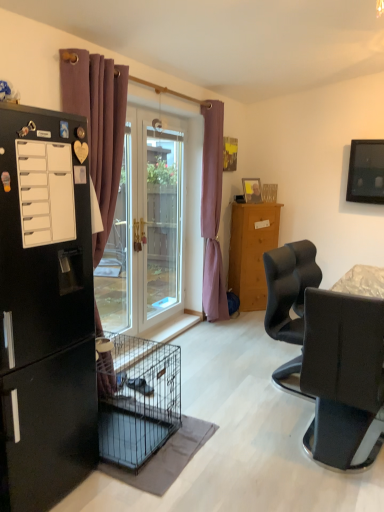
This screenshot has width=384, height=512. In order to click on purple fabric curtain at center, which appears as the second curtain when viewed from the left in this screenshot , I will do `click(212, 211)`.

What do you see at coordinates (44, 312) in the screenshot? I see `black matte refrigerator at left` at bounding box center [44, 312].

What do you see at coordinates (342, 372) in the screenshot? This screenshot has height=512, width=384. I see `matte black chair at right` at bounding box center [342, 372].

The width and height of the screenshot is (384, 512). Describe the element at coordinates (98, 124) in the screenshot. I see `purple fabric curtain at left, the 1th curtain positioned from the left` at that location.

At what (x,y) coordinates should I click in order to perform the action: click on matte black refrigerator at center. Please return your answer as a coordinate pair (x, y). Image resolution: width=384 pixels, height=512 pixels. Looking at the image, I should click on (251, 251).

What do you see at coordinates (45, 192) in the screenshot?
I see `white matte drawer at left` at bounding box center [45, 192].

What is the approximate width of transparent glass screen door at center?

The width of transparent glass screen door at center is 4.80 inches.

The height and width of the screenshot is (512, 384). Identify the location of wooden picture frame at upper center. (252, 190).

From a real-world perspective, is matte black refrigerator at center located higher than transparent glass screen door at center?

No, from a real-world perspective, matte black refrigerator at center is not above transparent glass screen door at center.

From the image's perspective, which one is positioned lower, matte black refrigerator at center or transparent glass screen door at center?

From the image's view, matte black refrigerator at center is below.

How distant is matte black refrigerator at center from transparent glass screen door at center?

The distance of matte black refrigerator at center from transparent glass screen door at center is 95.48 centimeters.

Does matte black refrigerator at center have a greater width compared to transparent glass screen door at center?

Indeed, matte black refrigerator at center has a greater width compared to transparent glass screen door at center.

From a real-world perspective, which object stands above the other?

In real-world perspective, matte black television at upper right is above.

Considering the sizes of objects matte black television at upper right and wooden picture frame at upper center in the image provided, who is smaller, matte black television at upper right or wooden picture frame at upper center?

wooden picture frame at upper center is smaller.

Is matte black television at upper right not inside wooden picture frame at upper center?

Yes, matte black television at upper right is not within wooden picture frame at upper center.

From the image's perspective, who appears lower, matte black television at upper right or wooden picture frame at upper center?

wooden picture frame at upper center.

From a real-world perspective, which is physically below, wooden picture frame at upper center or black matte refrigerator at left?

In real-world perspective, black matte refrigerator at left is lower.

Relative to black matte refrigerator at left, is wooden picture frame at upper center in front or behind?

In the image, wooden picture frame at upper center appears behind black matte refrigerator at left.

Is point (259, 180) farther from viewer compared to point (12, 113)?

Yes, it is behind point (12, 113).

Measure the distance between wooden picture frame at upper center and black matte refrigerator at left.

10.99 feet.

Who is bigger, matte black television at upper right or purple fabric curtain at left, which is the 2th curtain in right-to-left order?

purple fabric curtain at left, which is the 2th curtain in right-to-left order, is bigger.

Between matte black television at upper right and purple fabric curtain at left, arranged as the first curtain when viewed from the front, which one is positioned in front?

purple fabric curtain at left, arranged as the first curtain when viewed from the front, is closer to the camera.

Which is more to the left, matte black television at upper right or purple fabric curtain at left, acting as the second curtain starting from the back?

From the viewer's perspective, purple fabric curtain at left, acting as the second curtain starting from the back, appears more on the left side.

Which object is thinner, matte black television at upper right or purple fabric curtain at left, arranged as the first curtain when viewed from the front?

Thinner between the two is matte black television at upper right.

Is white matte drawer at left located within matte black chair at right?

Definitely not — white matte drawer at left is not inside matte black chair at right.

Considering the sizes of objects matte black chair at right and white matte drawer at left in the image provided, who is wider, matte black chair at right or white matte drawer at left?

matte black chair at right.

Does matte black chair at right have a greater height compared to white matte drawer at left?

Indeed, matte black chair at right has a greater height compared to white matte drawer at left.

How many degrees apart are the facing directions of matte black chair at right and white matte drawer at left?

The facing directions of matte black chair at right and white matte drawer at left are 88.8 degrees apart.

Relative to matte black chair at right, is matte black refrigerator at center in front or behind?

Visually, matte black refrigerator at center is located behind matte black chair at right.

Can you confirm if matte black refrigerator at center is bigger than matte black chair at right?

Incorrect, matte black refrigerator at center is not larger than matte black chair at right.

Can you tell me how much matte black refrigerator at center and matte black chair at right differ in facing direction?

132 degrees.

In order to click on chair on the right of matte black refrigerator at center in this screenshot , I will do `click(342, 372)`.

From the image's perspective, relative to wooden picture frame at upper center, is matte black refrigerator at center above or below?

Clearly, from the image's perspective, matte black refrigerator at center is below wooden picture frame at upper center.

Locate an element on the screen. Image resolution: width=384 pixels, height=512 pixels. refrigerator that is on the right side of wooden picture frame at upper center is located at coordinates (251, 251).

Between point (270, 236) and point (251, 180), which one is positioned in front?

Positioned in front is point (270, 236).

How many degrees apart are the facing directions of matte black refrigerator at center and wooden picture frame at upper center?

The facing directions of matte black refrigerator at center and wooden picture frame at upper center are 7.51 degrees apart.

I want to click on screen door located on the left of matte black refrigerator at center, so 161,220.

Locate an element on the screen. This screenshot has height=512, width=384. television above the wooden picture frame at upper center (from the image's perspective) is located at coordinates (366, 172).

Based on their spatial positions, is wooden picture frame at upper center or purple fabric curtain at center, acting as the second curtain starting from the front, closer to black matte refrigerator at left?

Based on the image, purple fabric curtain at center, acting as the second curtain starting from the front, appears to be nearer to black matte refrigerator at left.

From the image, which object appears to be nearer to black matte refrigerator at left, purple fabric curtain at center, which appears as the second curtain when viewed from the left, or purple fabric curtain at left, arranged as the first curtain when viewed from the front?

Based on the image, purple fabric curtain at left, arranged as the first curtain when viewed from the front, appears to be nearer to black matte refrigerator at left.

Which object lies nearer to the anchor point black matte refrigerator at left, purple fabric curtain at center, which is the first curtain from back to front, or white matte drawer at left?

white matte drawer at left is positioned closer to the anchor black matte refrigerator at left.

Which object lies further to the anchor point purple fabric curtain at center, acting as the 1th curtain starting from the right, transparent glass screen door at center or purple fabric curtain at left, which is the 2th curtain in right-to-left order?

Among the two, purple fabric curtain at left, which is the 2th curtain in right-to-left order, is located further to purple fabric curtain at center, acting as the 1th curtain starting from the right.

Considering their positions, is wooden picture frame at upper center positioned closer to purple fabric curtain at center, which appears as the second curtain when viewed from the left, than matte black refrigerator at center?

matte black refrigerator at center is closer to purple fabric curtain at center, which appears as the second curtain when viewed from the left.

Estimate the real-world distances between objects in this image. Which object is further from wooden picture frame at upper center, purple fabric curtain at center, which appears as the second curtain when viewed from the left, or matte black chair at right?

The object further to wooden picture frame at upper center is matte black chair at right.

Looking at this image, considering their positions, is white matte drawer at left positioned closer to matte black chair at right than matte black television at upper right?

The object closer to matte black chair at right is white matte drawer at left.

Considering their positions, is wooden picture frame at upper center positioned closer to matte black television at upper right than black matte refrigerator at left?

wooden picture frame at upper center is positioned closer to the anchor matte black television at upper right.

Locate an element on the screen. television positioned between white matte drawer at left and matte black refrigerator at center from near to far is located at coordinates (366, 172).

Locate an element on the screen. Image resolution: width=384 pixels, height=512 pixels. curtain situated between purple fabric curtain at left, acting as the second curtain starting from the back, and matte black chair at right from left to right is located at coordinates coord(212,211).

The height and width of the screenshot is (512, 384). I want to click on curtain between transparent glass screen door at center and matte black television at upper right in the horizontal direction, so click(212, 211).

The width and height of the screenshot is (384, 512). Find the location of `refrigerator between purple fabric curtain at center, which appears as the second curtain when viewed from the left, and wooden picture frame at upper center, along the z-axis`. refrigerator between purple fabric curtain at center, which appears as the second curtain when viewed from the left, and wooden picture frame at upper center, along the z-axis is located at coordinates (251, 251).